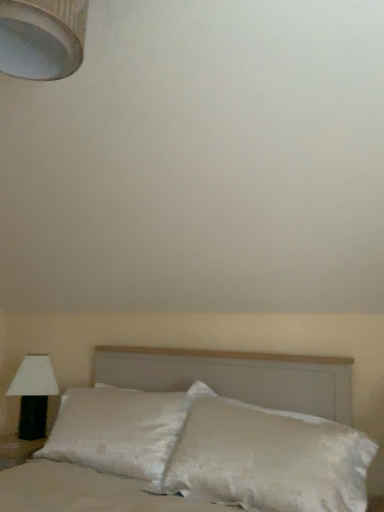
Question: Is white satin bed at center bigger or smaller than white satin pillow at center?

Choices:
 (A) small
 (B) big

Answer: (B)

Question: In the image, is white satin bed at center positioned in front of or behind white satin pillow at center?

Choices:
 (A) behind
 (B) front

Answer: (B)

Question: Based on their relative distances, which object is nearer to the black fabric lamp at left, which is the first lamp in left-to-right order?

Choices:
 (A) white textured lampshade at upper left, which is counted as the 2th lamp, starting from the back
 (B) white satin bed at center
 (C) white satin pillow at center

Answer: (C)

Question: Based on their relative distances, which object is farther from the white satin bed at center?

Choices:
 (A) white textured lampshade at upper left, placed as the first lamp when sorted from right to left
 (B) black fabric lamp at left, acting as the second lamp starting from the front
 (C) white satin pillow at center

Answer: (A)